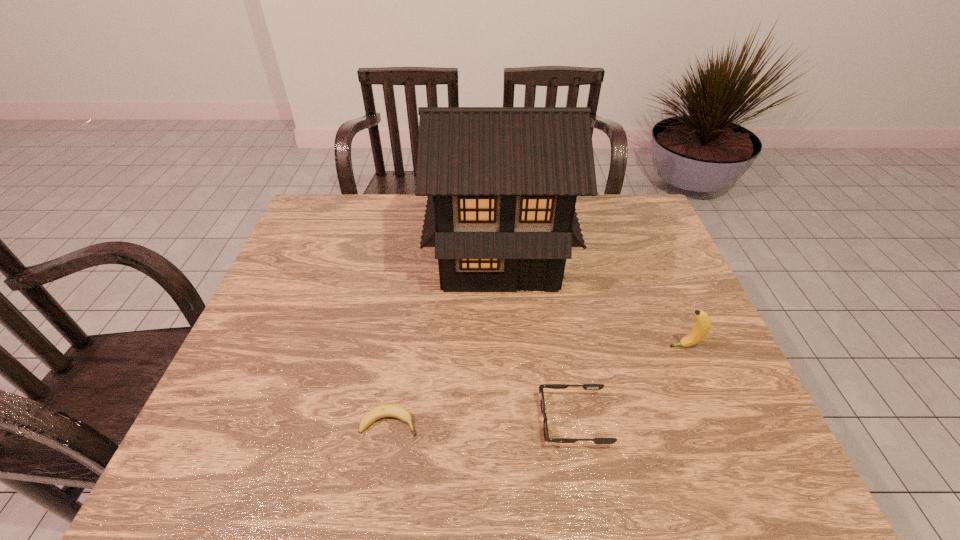
This screenshot has height=540, width=960. What are the coordinates of `dollhouse` in the screenshot? It's located at (502, 182).

The image size is (960, 540). Identify the location of the tallest object. (502, 182).

The width and height of the screenshot is (960, 540). Identify the location of the farther banana. (701, 328).

Find the location of a particular element. the second farthest object is located at coordinates pos(701,328).

Identify the location of the second shortest object. The image size is (960, 540). (551, 386).

Find the location of a particular element. The image size is (960, 540). the shorter banana is located at coordinates (387, 410).

Locate an element on the screen. This screenshot has width=960, height=540. the left banana is located at coordinates (387, 410).

Find the location of `free location located on the front-facing side of the dollhouse`. free location located on the front-facing side of the dollhouse is located at coordinates (502, 318).

What are the coordinates of `vacant space located from the stem of the taller banana` in the screenshot? It's located at (557, 346).

The width and height of the screenshot is (960, 540). In order to click on free space located from the stem of the taller banana in this screenshot , I will do `click(520, 346)`.